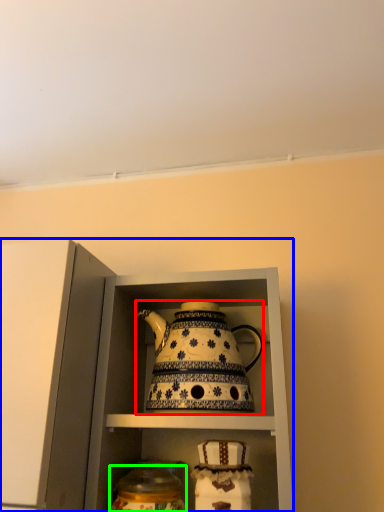
Question: Which object is the farthest from kettle (highlighted by a red box)? Choose among these: cabinetry (highlighted by a blue box) or tableware (highlighted by a green box).

Choices:
 (A) cabinetry
 (B) tableware

Answer: (B)